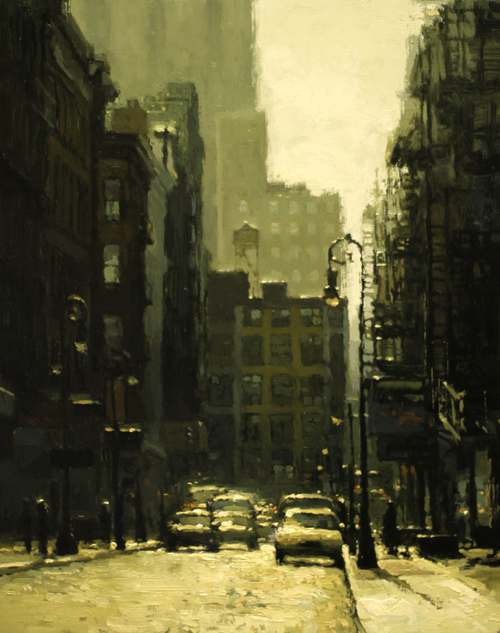
Locate an element on the screen. This screenshot has height=633, width=500. light is located at coordinates (330, 303).